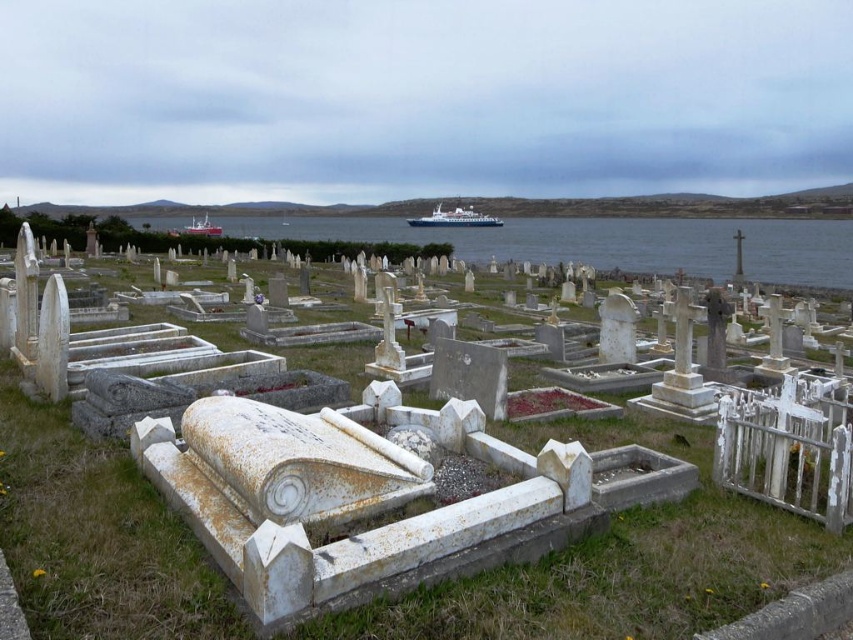
Does blue water at center have a lesser width compared to white plastic boat at center?

Incorrect, blue water at center's width is not less than white plastic boat at center's.

Who is more distant from viewer, (479,259) or (200,228)?

The point (200,228) is more distant.

The height and width of the screenshot is (640, 853). I want to click on blue water at center, so click(x=608, y=243).

Does white marble tombstones at center have a smaller size compared to white glossy boat at center?

Yes.

Does white marble tombstones at center have a lesser height compared to white glossy boat at center?

Correct, white marble tombstones at center is not as tall as white glossy boat at center.

Where is `white marble tombstones at center`? white marble tombstones at center is located at coordinates (486, 554).

Does point (281, 230) lie behind point (462, 225)?

No, (281, 230) is closer to viewer.

Between blue water at center and white glossy boat at center, which one appears on the right side from the viewer's perspective?

blue water at center is more to the right.

I want to click on blue water at center, so click(x=608, y=243).

Find the location of a particular element. This screenshot has height=640, width=853. blue water at center is located at coordinates (608, 243).